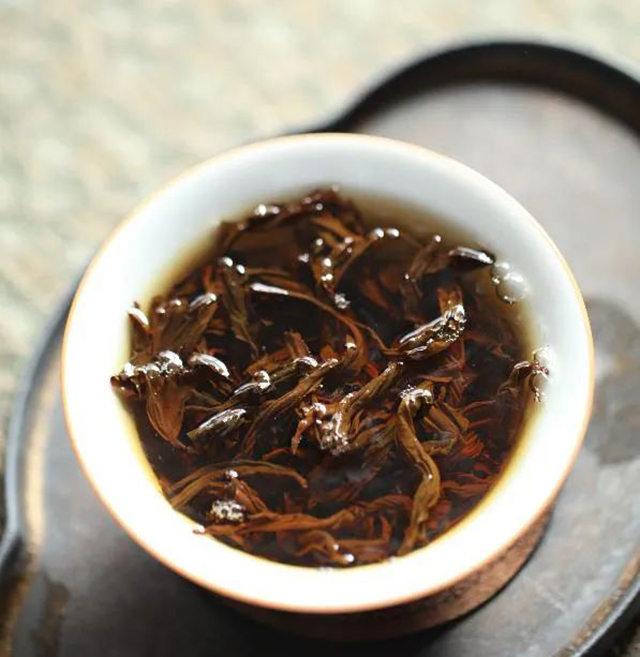
Find the location of a particular element. tray is located at coordinates (557, 219).